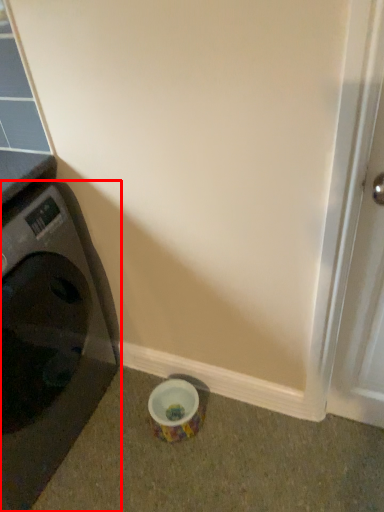
Question: Considering the relative positions of washing machine (annotated by the red box) and screen door in the image provided, where is washing machine (annotated by the red box) located with respect to the staircase?

Choices:
 (A) left
 (B) right

Answer: (A)